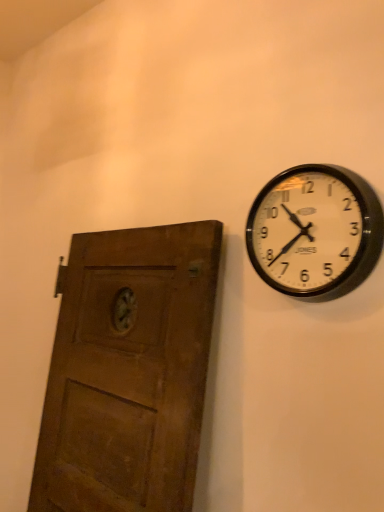
The width and height of the screenshot is (384, 512). What do you see at coordinates (315, 232) in the screenshot?
I see `black plastic clock at upper right` at bounding box center [315, 232].

Identify the location of black plastic clock at upper right. This screenshot has width=384, height=512. (315, 232).

I want to click on black plastic clock at upper right, so click(x=315, y=232).